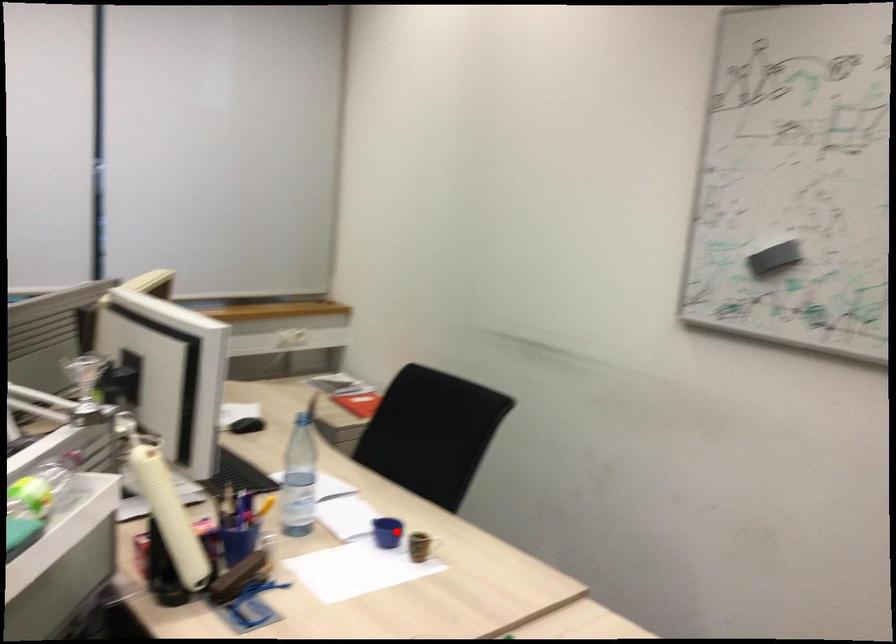
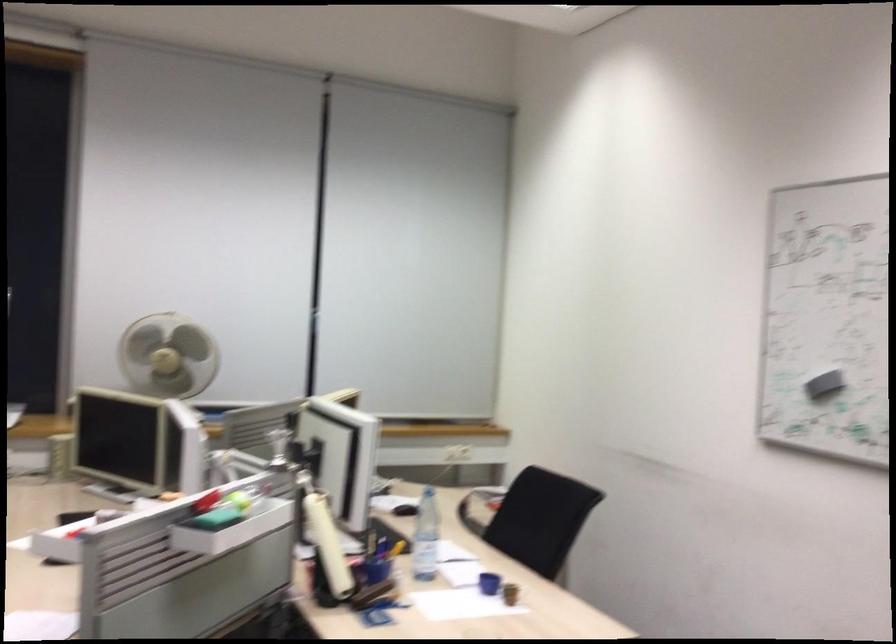
Question: I am providing you with two images of the same scene from different viewpoints. A red point is shown in image1. For the corresponding object point in image2, is it positioned nearer or farther from the camera?

Choices:
 (A) Nearer
 (B) Farther

Answer: (B)